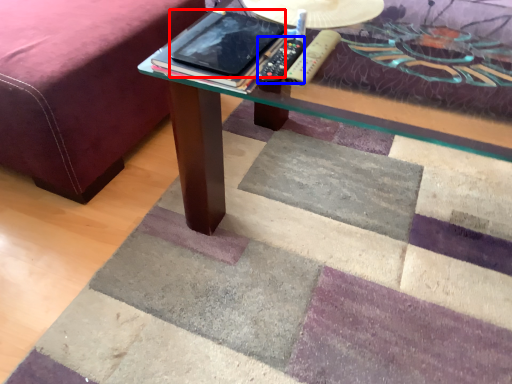
Question: Which object appears farthest to the camera in this image, tablet computer (highlighted by a red box) or remote (highlighted by a blue box)?

Choices:
 (A) tablet computer
 (B) remote

Answer: (B)